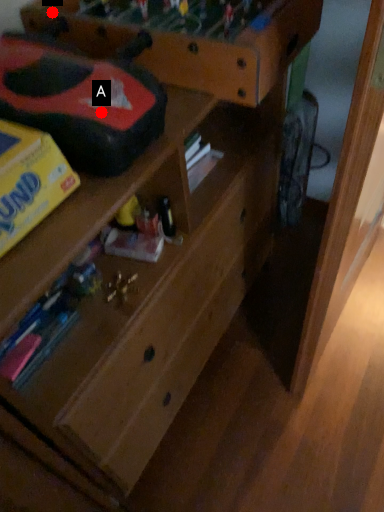
Question: Two points are circled on the image, labeled by A and B beside each circle. Which point is farther from the camera taking this photo?

Choices:
 (A) A is further
 (B) B is further

Answer: (B)